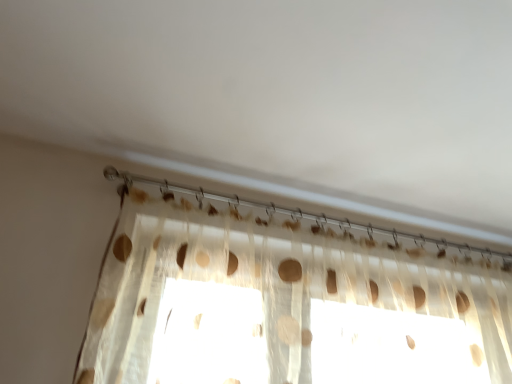
Question: Considering the relative sizes of translucent fabric at upper center and translucent fabric curtain at upper center in the image provided, is translucent fabric at upper center wider than translucent fabric curtain at upper center?

Choices:
 (A) no
 (B) yes

Answer: (A)

Question: From the image's perspective, does translucent fabric at upper center appear higher than translucent fabric curtain at upper center?

Choices:
 (A) yes
 (B) no

Answer: (A)

Question: From the image's perspective, is translucent fabric at upper center below translucent fabric curtain at upper center?

Choices:
 (A) no
 (B) yes

Answer: (A)

Question: Does translucent fabric at upper center have a greater height compared to translucent fabric curtain at upper center?

Choices:
 (A) yes
 (B) no

Answer: (B)

Question: Does translucent fabric at upper center touch translucent fabric curtain at upper center?

Choices:
 (A) yes
 (B) no

Answer: (B)

Question: Considering the relative sizes of translucent fabric at upper center and translucent fabric curtain at upper center in the image provided, is translucent fabric at upper center thinner than translucent fabric curtain at upper center?

Choices:
 (A) no
 (B) yes

Answer: (B)

Question: Is the depth of translucent fabric curtain at upper center greater than that of translucent fabric at upper center?

Choices:
 (A) yes
 (B) no

Answer: (B)

Question: From a real-world perspective, is translucent fabric curtain at upper center over translucent fabric at upper center?

Choices:
 (A) yes
 (B) no

Answer: (B)

Question: Considering the relative sizes of translucent fabric curtain at upper center and translucent fabric at upper center in the image provided, is translucent fabric curtain at upper center taller than translucent fabric at upper center?

Choices:
 (A) yes
 (B) no

Answer: (A)

Question: From the image's perspective, does translucent fabric curtain at upper center appear lower than translucent fabric at upper center?

Choices:
 (A) yes
 (B) no

Answer: (A)

Question: Is translucent fabric curtain at upper center completely or partially outside of translucent fabric at upper center?

Choices:
 (A) no
 (B) yes

Answer: (B)

Question: Is translucent fabric curtain at upper center shorter than translucent fabric at upper center?

Choices:
 (A) yes
 (B) no

Answer: (B)

Question: Considering the positions of translucent fabric curtain at upper center and translucent fabric at upper center in the image, is translucent fabric curtain at upper center wider or thinner than translucent fabric at upper center?

Choices:
 (A) thin
 (B) wide

Answer: (B)